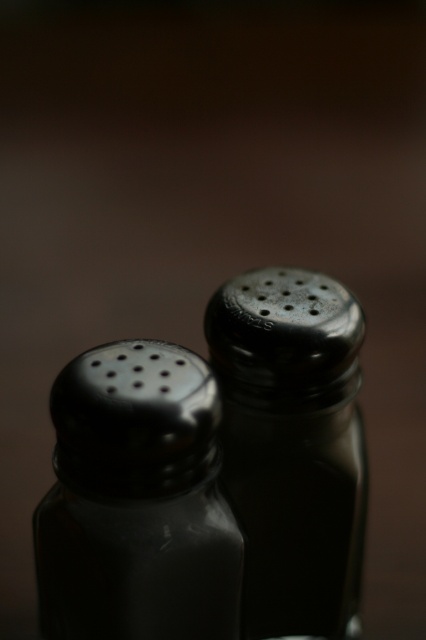
From the picture: Can you confirm if satin black salt shaker at center is thinner than satin black pepper shaker at center?

No.

Which is in front, point (100, 506) or point (327, 465)?

Point (100, 506)

Between point (235, 595) and point (330, 384), which one is positioned behind?

Point (330, 384)

Where is `satin black salt shaker at center`? The height and width of the screenshot is (640, 426). satin black salt shaker at center is located at coordinates (137, 500).